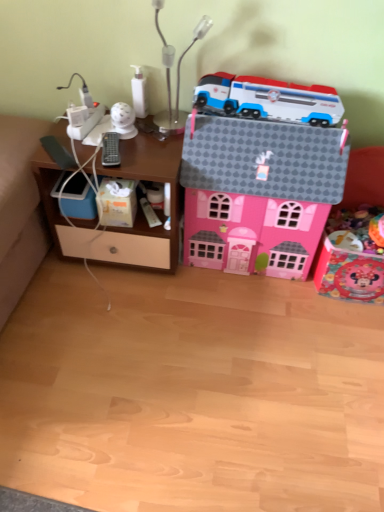
This screenshot has width=384, height=512. What are the coordinates of `free space in front of white glossy bottle at upper center, positioned as the 5th toy in right-to-left order` in the screenshot? It's located at (142, 142).